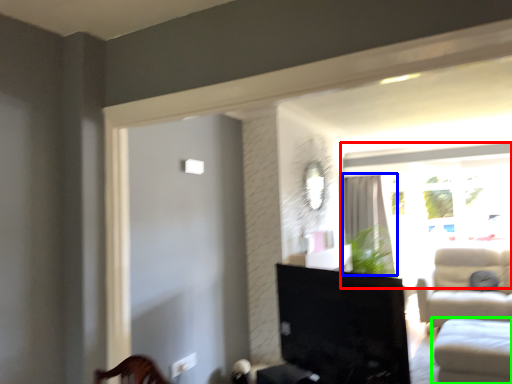
Question: Which object is the farthest from window (highlighted by a red box)? Choose among these: curtain (highlighted by a blue box) or studio couch (highlighted by a green box).

Choices:
 (A) curtain
 (B) studio couch

Answer: (B)